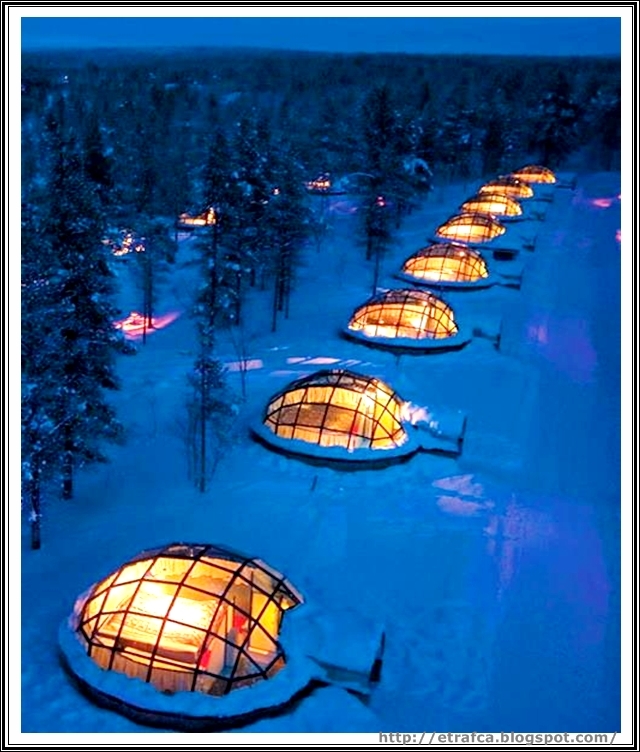
Identify the location of frame. The width and height of the screenshot is (640, 752). (431, 2).